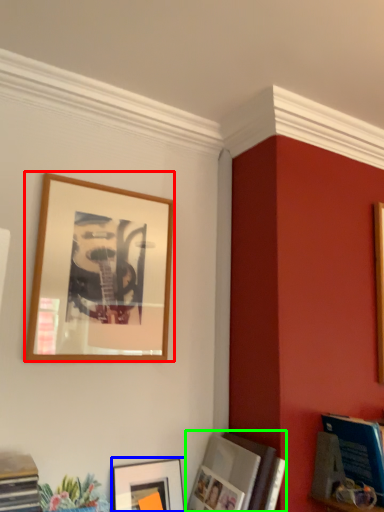
Question: Which object is positioned farthest from picture frame (highlighted by a red box)? Select from picture frame (highlighted by a blue box) and picture frame (highlighted by a green box).

Choices:
 (A) picture frame
 (B) picture frame

Answer: (B)